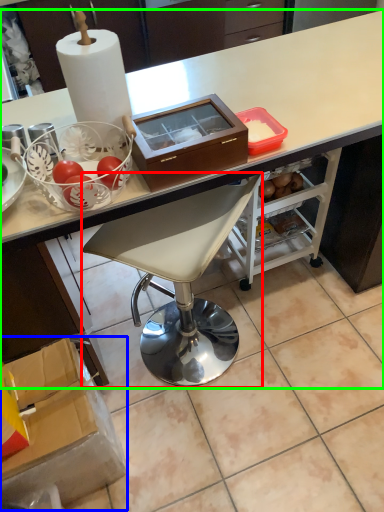
Question: Considering the real-world distances, which object is farthest from chair (highlighted by a red box)? box (highlighted by a blue box) or desk (highlighted by a green box)?

Choices:
 (A) box
 (B) desk

Answer: (B)